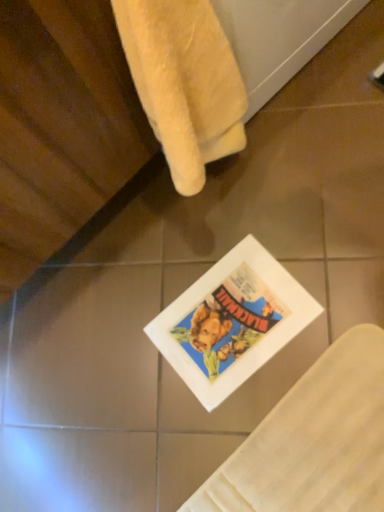
At what (x,y) coordinates should I click in order to perform the action: click on unoccupied space behind matte paper comic book at center. Please return your answer as a coordinate pair (x, y). Looking at the image, I should click on (168, 244).